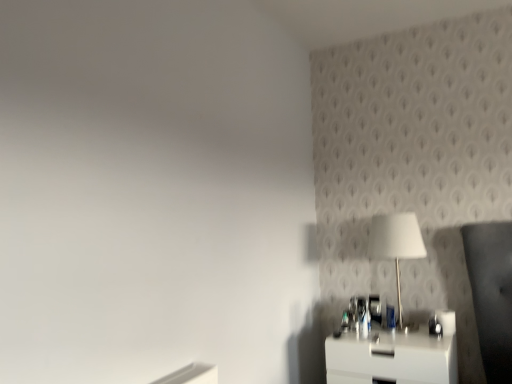
Question: Considering the positions of white glossy table lamp at upper right and white glossy nightstand at lower right in the image, is white glossy table lamp at upper right taller or shorter than white glossy nightstand at lower right?

Choices:
 (A) short
 (B) tall

Answer: (B)

Question: Relative to white glossy nightstand at lower right, is white glossy table lamp at upper right in front or behind?

Choices:
 (A) behind
 (B) front

Answer: (A)

Question: From a real-world perspective, is white glossy table lamp at upper right physically located above or below white glossy nightstand at lower right?

Choices:
 (A) above
 (B) below

Answer: (A)

Question: Considering the positions of white glossy nightstand at lower right and white glossy table lamp at upper right in the image, is white glossy nightstand at lower right wider or thinner than white glossy table lamp at upper right?

Choices:
 (A) wide
 (B) thin

Answer: (A)

Question: In terms of height, does white glossy nightstand at lower right look taller or shorter compared to white glossy table lamp at upper right?

Choices:
 (A) short
 (B) tall

Answer: (A)

Question: From the image's perspective, is white glossy nightstand at lower right positioned above or below white glossy table lamp at upper right?

Choices:
 (A) above
 (B) below

Answer: (B)

Question: In the image, is white glossy nightstand at lower right positioned in front of or behind white glossy table lamp at upper right?

Choices:
 (A) behind
 (B) front

Answer: (B)